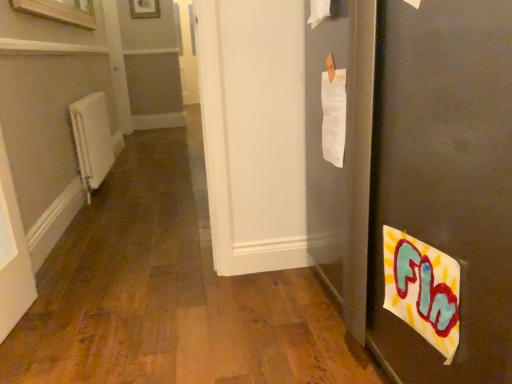
Question: From a real-world perspective, is matte black door at right positioned under white matte radiator at left based on gravity?

Choices:
 (A) no
 (B) yes

Answer: (A)

Question: Would you say matte black door at right contains white matte radiator at left?

Choices:
 (A) yes
 (B) no

Answer: (B)

Question: Does matte black door at right have a lesser height compared to white matte radiator at left?

Choices:
 (A) yes
 (B) no

Answer: (B)

Question: Can you confirm if matte black door at right is smaller than white matte radiator at left?

Choices:
 (A) no
 (B) yes

Answer: (A)

Question: From a real-world perspective, is matte black door at right over white matte radiator at left?

Choices:
 (A) yes
 (B) no

Answer: (A)

Question: Is matte black door at right positioned with its back to white matte radiator at left?

Choices:
 (A) yes
 (B) no

Answer: (B)

Question: Considering the relative positions of white matte radiator at left and matte black door at right in the image provided, is white matte radiator at left in front of matte black door at right?

Choices:
 (A) yes
 (B) no

Answer: (B)

Question: From the image's perspective, does white matte radiator at left appear higher than matte black door at right?

Choices:
 (A) no
 (B) yes

Answer: (B)

Question: From a real-world perspective, does white matte radiator at left sit lower than matte black door at right?

Choices:
 (A) yes
 (B) no

Answer: (A)

Question: Is white matte radiator at left oriented away from matte black door at right?

Choices:
 (A) no
 (B) yes

Answer: (A)

Question: Is white matte radiator at left bigger than matte black door at right?

Choices:
 (A) yes
 (B) no

Answer: (B)

Question: Considering the relative sizes of white matte radiator at left and matte black door at right in the image provided, is white matte radiator at left wider than matte black door at right?

Choices:
 (A) yes
 (B) no

Answer: (B)

Question: From the image's perspective, is matte black door at right on top of wooden frame at upper center?

Choices:
 (A) yes
 (B) no

Answer: (B)